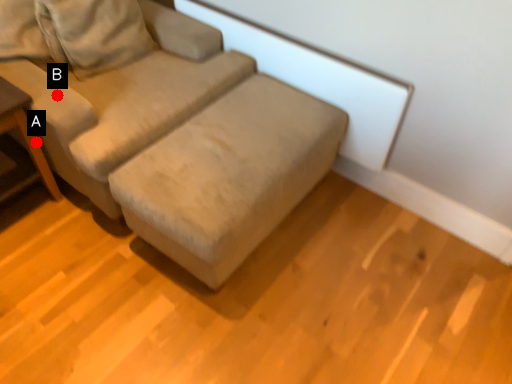
Question: Two points are circled on the image, labeled by A and B beside each circle. Which point is farther from the camera taking this photo?

Choices:
 (A) A is further
 (B) B is further

Answer: (A)